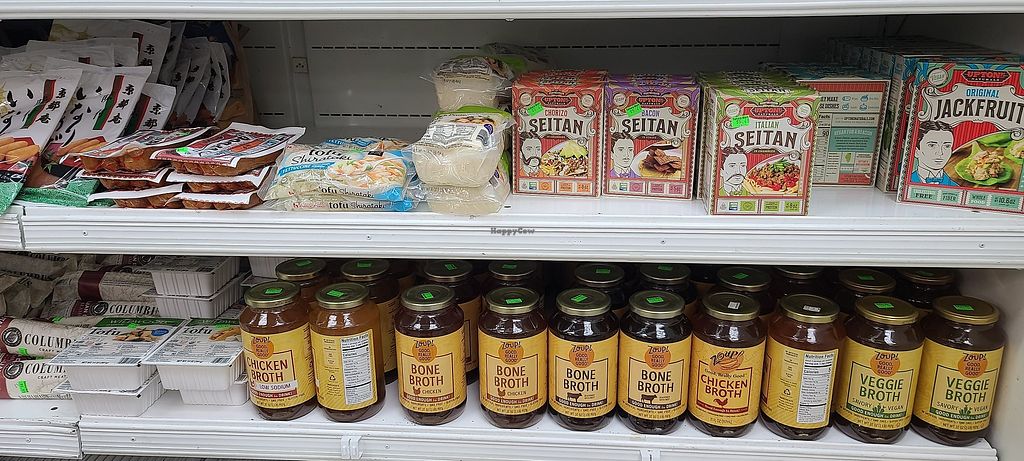
This screenshot has width=1024, height=461. What are the coordinates of `shelf` in the screenshot? It's located at (187, 233), (170, 436).